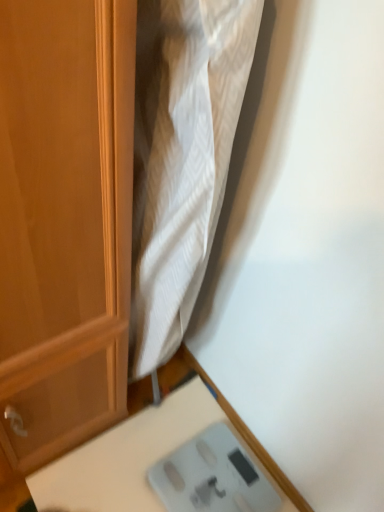
Identify the location of white plastic scale at lower right. The image size is (384, 512). (134, 457).

Describe the element at coordinates (134, 457) in the screenshot. Image resolution: width=384 pixels, height=512 pixels. I see `white plastic scale at lower right` at that location.

The width and height of the screenshot is (384, 512). What do you see at coordinates (212, 476) in the screenshot?
I see `gray plastic scale at lower right` at bounding box center [212, 476].

The width and height of the screenshot is (384, 512). I want to click on gray plastic scale at lower right, so click(x=212, y=476).

This screenshot has height=512, width=384. Identify the location of white plastic scale at lower right. (134, 457).

Which object is positioned more to the left, gray plastic scale at lower right or white plastic scale at lower right?

white plastic scale at lower right is more to the left.

Which object is more forward, gray plastic scale at lower right or white plastic scale at lower right?

white plastic scale at lower right.

Is point (225, 434) closer or farther from the camera than point (155, 434)?

Point (225, 434).

From the image's perspective, is gray plastic scale at lower right above or below white plastic scale at lower right?

Based on their image positions, gray plastic scale at lower right is located above white plastic scale at lower right.

From a real-world perspective, is gray plastic scale at lower right positioned above or below white plastic scale at lower right?

In terms of real-world spatial position, gray plastic scale at lower right is below white plastic scale at lower right.

Does gray plastic scale at lower right have a greater width compared to white plastic scale at lower right?

In fact, gray plastic scale at lower right might be narrower than white plastic scale at lower right.

Between gray plastic scale at lower right and white plastic scale at lower right, which one has more height?

white plastic scale at lower right.

Considering the sizes of objects gray plastic scale at lower right and white plastic scale at lower right in the image provided, who is smaller, gray plastic scale at lower right or white plastic scale at lower right?

With smaller size is gray plastic scale at lower right.

Is gray plastic scale at lower right completely or partially outside of white plastic scale at lower right?

No, gray plastic scale at lower right is not entirely external to white plastic scale at lower right.

Are gray plastic scale at lower right and white plastic scale at lower right making contact?

Yes.

Is gray plastic scale at lower right oriented away from white plastic scale at lower right?

Yes, gray plastic scale at lower right's orientation is away from white plastic scale at lower right.

How many degrees apart are the facing directions of gray plastic scale at lower right and white plastic scale at lower right?

8.89 degrees.

Measure the distance from gray plastic scale at lower right to white plastic scale at lower right.

gray plastic scale at lower right and white plastic scale at lower right are 3.82 inches apart.

Identify the location of table that appears below the gray plastic scale at lower right (from the image's perspective). coord(134,457).

Is white plastic scale at lower right at the right side of gray plastic scale at lower right?

Incorrect, white plastic scale at lower right is not on the right side of gray plastic scale at lower right.

Is white plastic scale at lower right closer to camera compared to gray plastic scale at lower right?

Yes, white plastic scale at lower right is closer to the viewer.

Between point (116, 460) and point (230, 435), which one is positioned behind?

The point (230, 435) is behind.

From the image's perspective, does white plastic scale at lower right appear lower than gray plastic scale at lower right?

Correct, white plastic scale at lower right appears lower than gray plastic scale at lower right in the image.

From a real-world perspective, which object stands above the other?

white plastic scale at lower right.

In terms of width, does white plastic scale at lower right look wider or thinner when compared to gray plastic scale at lower right?

Considering their sizes, white plastic scale at lower right looks broader than gray plastic scale at lower right.

In terms of height, does white plastic scale at lower right look taller or shorter compared to gray plastic scale at lower right?

In the image, white plastic scale at lower right appears to be taller than gray plastic scale at lower right.

Between white plastic scale at lower right and gray plastic scale at lower right, which one has larger size?

With larger size is white plastic scale at lower right.

Would you say white plastic scale at lower right is inside or outside gray plastic scale at lower right?

white plastic scale at lower right is located beyond the bounds of gray plastic scale at lower right.

Is white plastic scale at lower right positioned far away from gray plastic scale at lower right?

No, white plastic scale at lower right is not far from gray plastic scale at lower right.

Is white plastic scale at lower right oriented away from gray plastic scale at lower right?

Correct, white plastic scale at lower right is looking away from gray plastic scale at lower right.

How different are the orientations of white plastic scale at lower right and gray plastic scale at lower right in degrees?

They differ by 8.89 degrees in their facing directions.

The width and height of the screenshot is (384, 512). What are the coordinates of `table in front of the gray plastic scale at lower right` in the screenshot? It's located at (134, 457).

This screenshot has height=512, width=384. I want to click on table that is below the gray plastic scale at lower right (from the image's perspective), so click(x=134, y=457).

At what (x,y) coordinates should I click in order to perform the action: click on scale below the white plastic scale at lower right (from a real-world perspective). Please return your answer as a coordinate pair (x, y). This screenshot has height=512, width=384. Looking at the image, I should click on (212, 476).